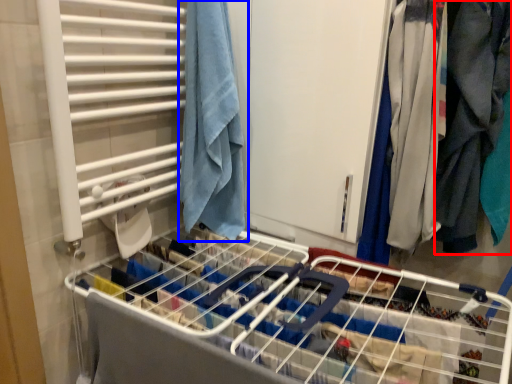
Question: Which of the following is the farthest to the observer, clothing (highlighted by a red box) or towel (highlighted by a blue box)?

Choices:
 (A) clothing
 (B) towel

Answer: (B)